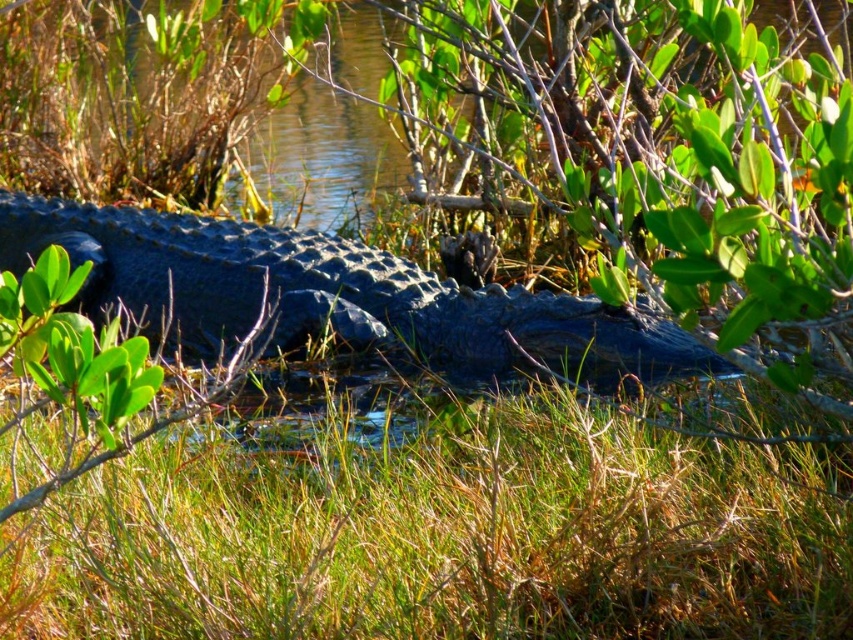
Question: Is green grass at lower center further to the viewer compared to shiny dark blue crocodile at center?

Choices:
 (A) yes
 (B) no

Answer: (B)

Question: Does green grass at lower center come in front of shiny dark blue crocodile at center?

Choices:
 (A) yes
 (B) no

Answer: (A)

Question: Which point is closer to the camera?

Choices:
 (A) (753, 474)
 (B) (218, 340)

Answer: (A)

Question: Among these points, which one is farthest from the camera?

Choices:
 (A) (454, 477)
 (B) (71, 209)

Answer: (B)

Question: Is green grass at lower center in front of shiny dark blue crocodile at center?

Choices:
 (A) no
 (B) yes

Answer: (B)